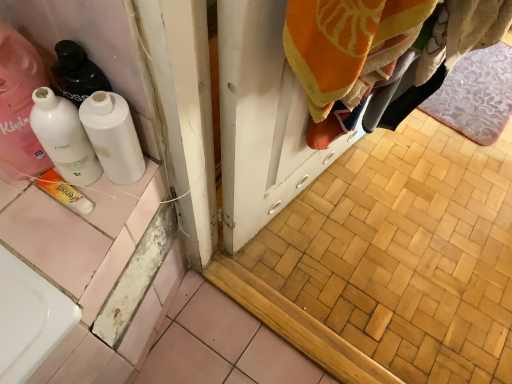
I want to click on white glossy bottle at left, the 1th bottle viewed from the right, so click(113, 136).

Describe the element at coordinates (64, 192) in the screenshot. I see `yellow matte tube at lower left` at that location.

Image resolution: width=512 pixels, height=384 pixels. I want to click on pink floral bath mat at lower right, so click(476, 95).

Where is `white glossy bottle at left, the first bottle positioned from the left`? The image size is (512, 384). white glossy bottle at left, the first bottle positioned from the left is located at coordinates (64, 137).

Considering the sizes of objects white glossy bottle at left, which is the second bottle in right-to-left order, and white glossy bottle at left, placed as the 2th bottle when sorted from left to right, in the image provided, who is thinner, white glossy bottle at left, which is the second bottle in right-to-left order, or white glossy bottle at left, placed as the 2th bottle when sorted from left to right,?

Thinner between the two is white glossy bottle at left, placed as the 2th bottle when sorted from left to right.

Can you confirm if white glossy bottle at left, the first bottle positioned from the left, is positioned to the right of white glossy bottle at left, the 1th bottle viewed from the right?

No, white glossy bottle at left, the first bottle positioned from the left, is not to the right of white glossy bottle at left, the 1th bottle viewed from the right.

Between point (62, 97) and point (124, 181), which one is positioned behind?

Positioned behind is point (124, 181).

Do you think white glossy bottle at left, which is the second bottle in right-to-left order, is within white glossy bottle at left, placed as the 2th bottle when sorted from left to right, or outside of it?

white glossy bottle at left, which is the second bottle in right-to-left order, cannot be found inside white glossy bottle at left, placed as the 2th bottle when sorted from left to right.

How distant is white glossy bottle at left from white glossy bottle at left, the 1th bottle viewed from the right?

white glossy bottle at left and white glossy bottle at left, the 1th bottle viewed from the right, are 10.94 centimeters apart from each other.

Is point (30, 138) behind point (135, 156)?

No, (30, 138) is closer to viewer.

Is white glossy bottle at left completely or partially outside of white glossy bottle at left, placed as the 2th bottle when sorted from left to right?

Absolutely, white glossy bottle at left is external to white glossy bottle at left, placed as the 2th bottle when sorted from left to right.

From a real-world perspective, which is physically above, white glossy bottle at left or white glossy bottle at left, the 1th bottle viewed from the right?

In real-world perspective, white glossy bottle at left is above.

Is white glossy bottle at left, placed as the 2th bottle when sorted from left to right, surrounding white glossy bottle at left, the first bottle positioned from the left?

That's incorrect, white glossy bottle at left, the first bottle positioned from the left, is not inside white glossy bottle at left, placed as the 2th bottle when sorted from left to right.

Could you tell me if white glossy bottle at left, the 1th bottle viewed from the right, is turned towards white glossy bottle at left, which is the second bottle in right-to-left order?

No, white glossy bottle at left, the 1th bottle viewed from the right, is not facing towards white glossy bottle at left, which is the second bottle in right-to-left order.

Which is in front, white glossy bottle at left, placed as the 2th bottle when sorted from left to right, or white glossy bottle at left, which is the second bottle in right-to-left order?

white glossy bottle at left, which is the second bottle in right-to-left order, is in front.

You are a GUI agent. You are given a task and a screenshot of the screen. Output one action in this format:
    pyautogui.click(x=<x>, y=<y>)
    Task: Click on the bottle on the right of white glossy bottle at left, which is the second bottle in right-to-left order
    Image resolution: width=512 pixels, height=384 pixels.
    Given the screenshot: What is the action you would take?
    pyautogui.click(x=113, y=136)

Considering the relative positions of pink floral bath mat at lower right and white glossy bottle at left, placed as the 2th bottle when sorted from left to right, in the image provided, is pink floral bath mat at lower right behind white glossy bottle at left, placed as the 2th bottle when sorted from left to right,?

Yes, it is behind white glossy bottle at left, placed as the 2th bottle when sorted from left to right.

Locate an element on the screen. This screenshot has height=384, width=512. the 1st bottle counting from the left side of the pink floral bath mat at lower right is located at coordinates (113, 136).

Looking at this image, from a real-world perspective, is pink floral bath mat at lower right above or below white glossy bottle at left, the 1th bottle viewed from the right?

pink floral bath mat at lower right is below white glossy bottle at left, the 1th bottle viewed from the right.

Considering the sizes of pink floral bath mat at lower right and white glossy bottle at left, the 1th bottle viewed from the right, in the image, is pink floral bath mat at lower right wider or thinner than white glossy bottle at left, the 1th bottle viewed from the right,?

pink floral bath mat at lower right is wider than white glossy bottle at left, the 1th bottle viewed from the right.

How distant is pink floral bath mat at lower right from white glossy bottle at left?

pink floral bath mat at lower right is 1.54 meters from white glossy bottle at left.

Is pink floral bath mat at lower right oriented away from white glossy bottle at left?

That's not correct — pink floral bath mat at lower right is not looking away from white glossy bottle at left.

How different are the orientations of pink floral bath mat at lower right and white glossy bottle at left in degrees?

177 degrees.

Is pink floral bath mat at lower right at the left side of white glossy bottle at left?

No.

Consider the image. Which is correct: white glossy bottle at left, placed as the 2th bottle when sorted from left to right, is inside white glossy bottle at left, or outside of it?

white glossy bottle at left, placed as the 2th bottle when sorted from left to right, is spatially situated outside white glossy bottle at left.

In the scene shown: Which object is positioned more to the left, white glossy bottle at left, placed as the 2th bottle when sorted from left to right, or white glossy bottle at left?

white glossy bottle at left.

Is white glossy bottle at left, the 1th bottle viewed from the right, smaller than white glossy bottle at left?

Indeed, white glossy bottle at left, the 1th bottle viewed from the right, has a smaller size compared to white glossy bottle at left.

Is white glossy bottle at left located outside pink floral bath mat at lower right?

white glossy bottle at left lies outside pink floral bath mat at lower right's area.

Which is more to the left, white glossy bottle at left or pink floral bath mat at lower right?

white glossy bottle at left is more to the left.

Where is `bottle located above the white glossy bottle at left, placed as the 2th bottle when sorted from left to right (from the image's perspective)`? bottle located above the white glossy bottle at left, placed as the 2th bottle when sorted from left to right (from the image's perspective) is located at coordinates (64, 137).

Locate an element on the screen. Image resolution: width=512 pixels, height=384 pixels. cleaning product that is on the left side of white glossy bottle at left, the 1th bottle viewed from the right is located at coordinates 19,105.

When comparing their distances from white glossy bottle at left, does white glossy bottle at left, the 1th bottle viewed from the right, or white glossy bottle at left, which is the second bottle in right-to-left order, seem further?

white glossy bottle at left, the 1th bottle viewed from the right, is further to white glossy bottle at left.

Looking at the image, which one is located further to white glossy bottle at left, the first bottle positioned from the left, white glossy bottle at left or yellow matte tube at lower left?

yellow matte tube at lower left.

Which object lies nearer to the anchor point yellow matte tube at lower left, pink floral bath mat at lower right or white glossy bottle at left?

Based on the image, white glossy bottle at left appears to be nearer to yellow matte tube at lower left.

Considering their positions, is pink floral bath mat at lower right positioned closer to white glossy bottle at left, the 1th bottle viewed from the right, than yellow matte tube at lower left?

yellow matte tube at lower left is positioned closer to the anchor white glossy bottle at left, the 1th bottle viewed from the right.

When comparing their distances from yellow matte tube at lower left, does pink floral bath mat at lower right or white glossy bottle at left, placed as the 2th bottle when sorted from left to right, seem closer?

white glossy bottle at left, placed as the 2th bottle when sorted from left to right.

Looking at the image, which one is located further to pink floral bath mat at lower right, white glossy bottle at left, the first bottle positioned from the left, or white glossy bottle at left, the 1th bottle viewed from the right?

white glossy bottle at left, the first bottle positioned from the left, lies further to pink floral bath mat at lower right than the other object.

Estimate the real-world distances between objects in this image. Which object is further from white glossy bottle at left, which is the second bottle in right-to-left order, white glossy bottle at left, the 1th bottle viewed from the right, or yellow matte tube at lower left?

yellow matte tube at lower left.

Considering their positions, is white glossy bottle at left, the 1th bottle viewed from the right, positioned closer to white glossy bottle at left, which is the second bottle in right-to-left order, than white glossy bottle at left?

white glossy bottle at left, the 1th bottle viewed from the right, is positioned closer to the anchor white glossy bottle at left, which is the second bottle in right-to-left order.

Locate an element on the screen. This screenshot has height=384, width=512. bottle located between white glossy bottle at left and white glossy bottle at left, the 1th bottle viewed from the right, in the left-right direction is located at coordinates (64, 137).

Locate an element on the screen. This screenshot has width=512, height=384. bottle located between white glossy bottle at left, the first bottle positioned from the left, and pink floral bath mat at lower right in the left-right direction is located at coordinates (113, 136).

The width and height of the screenshot is (512, 384). What are the coordinates of `bottle between white glossy bottle at left, the first bottle positioned from the left, and yellow matte tube at lower left from front to back` in the screenshot? It's located at (113, 136).

The width and height of the screenshot is (512, 384). Find the location of `product between white glossy bottle at left and pink floral bath mat at lower right`. product between white glossy bottle at left and pink floral bath mat at lower right is located at coordinates (64, 192).